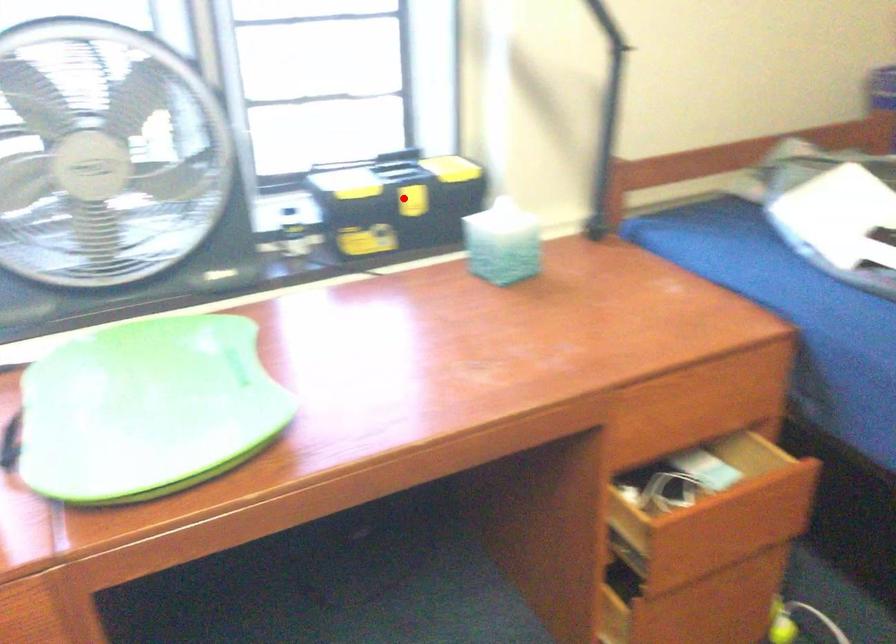
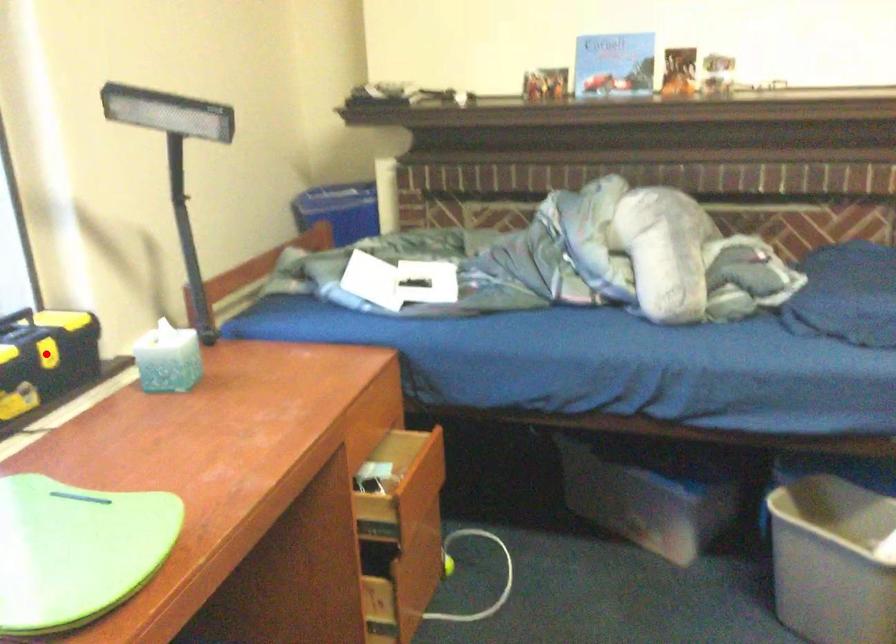
Based on the photo, I am providing you with two images of the same scene from different viewpoints. A red point is marked on the first image and another point is marked on the second image. Is the marked point in image1 the same physical position as the marked point in image2?

Yes